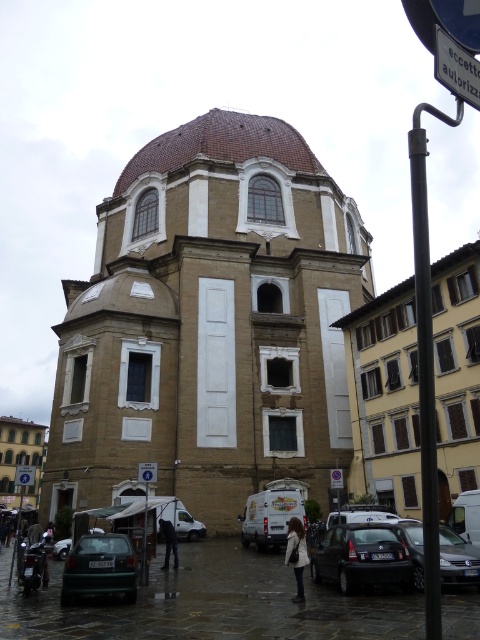
You are a tourist standing in front of the historic building and want to take a photo that includes both the matte beige church at lower left and the white plastic sign at upper center. Based on their positions, which object should you focus on first to ensure both are in the frame?

The matte beige church at lower left is located below the white plastic sign at upper center, so you should focus on the white plastic sign at upper center first to ensure both are in the frame.

You are standing in the city square and see the matte beige church at lower left and the white plastic sign at upper center. Which object is closer to you?

The matte beige church at lower left is closer to you because it is in front of the white plastic sign at upper center.

You are a delivery driver approaching the matte beige church at lower left and the silver metallic van at center. Which vehicle should you avoid hitting if you are driving towards the church?

You should avoid hitting the silver metallic van at center because it is in your path as you drive towards the matte beige church at lower left, which is located below it.